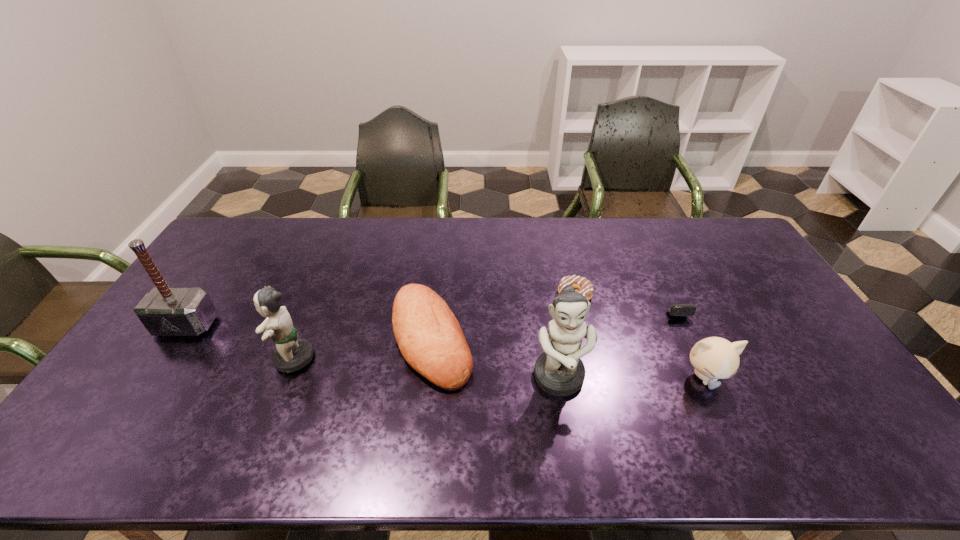
Locate an element on the screen. This screenshot has width=960, height=540. free space located 0.050m on the front-facing side of the sixth object from right to left is located at coordinates (252, 358).

This screenshot has width=960, height=540. I want to click on vacant area located 0.320m on the front-facing side of the sixth object from right to left, so click(155, 358).

Locate an element on the screen. Image resolution: width=960 pixels, height=540 pixels. vacant space located 0.050m on the front-facing side of the right figurine is located at coordinates (566, 422).

At what (x,y) coordinates should I click in order to perform the action: click on vacant space located on the left of the doughnut. Please return your answer as a coordinate pair (x, y). Image resolution: width=960 pixels, height=540 pixels. Looking at the image, I should click on (542, 294).

This screenshot has height=540, width=960. Identify the location of vacant space situated on the front-facing side of the webcam. (689, 346).

The height and width of the screenshot is (540, 960). I want to click on vacant point located 0.270m on the back of the hammer, so click(x=231, y=259).

Where is `vacant space located on the front of the third object from left to right`? This screenshot has height=540, width=960. vacant space located on the front of the third object from left to right is located at coordinates (424, 409).

You are a GUI agent. You are given a task and a screenshot of the screen. Output one action in this format:
    pyautogui.click(x=<x>, y=<y>)
    Task: Click on the free location located on the face of the kitten
    
    Given the screenshot: What is the action you would take?
    point(725,418)

Find the location of a particular element. The width and height of the screenshot is (960, 540). figurine that is positioned at the near edge is located at coordinates (559, 371).

The image size is (960, 540). In order to click on bread at the near edge in this screenshot , I will do `click(430, 338)`.